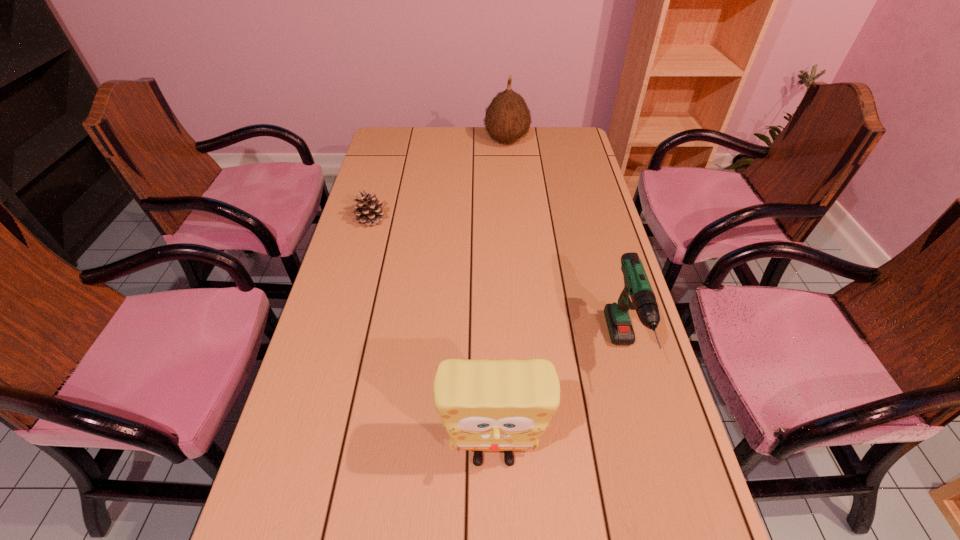
The image size is (960, 540). Find the location of `free space between the farthest object and the rightmost object`. free space between the farthest object and the rightmost object is located at coordinates (565, 246).

I want to click on vacant region between the coconut and the third nearest object, so pyautogui.click(x=439, y=180).

Where is `free point between the drill and the leftmost object`? free point between the drill and the leftmost object is located at coordinates (497, 286).

Where is `free space between the second farthest object and the nearest object`? This screenshot has width=960, height=540. free space between the second farthest object and the nearest object is located at coordinates (432, 338).

You are a GUI agent. You are given a task and a screenshot of the screen. Output one action in this format:
    pyautogui.click(x=<x>, y=<y>)
    Task: Click on the free spot between the nearest object and the coconut
    The image size is (960, 540).
    Given the screenshot: What is the action you would take?
    pyautogui.click(x=500, y=298)

Locate an element on the screen. The height and width of the screenshot is (540, 960). vacant point located between the pinecone and the third farthest object is located at coordinates (497, 286).

The height and width of the screenshot is (540, 960). Find the location of `object that can be found as the third closest to the third nearest object`. object that can be found as the third closest to the third nearest object is located at coordinates (637, 294).

Where is `object that can be found as the closest to the shortest object`? object that can be found as the closest to the shortest object is located at coordinates (507, 118).

At what (x,y) coordinates should I click in order to perform the action: click on vacant space that satisfies the following two spatial constraints: 1. on the surface of the coconut; 2. on the front side of the second farthest object. Please return your answer as a coordinate pair (x, y). This screenshot has height=540, width=960. Looking at the image, I should click on (514, 220).

Where is `vacant region that satisfies the following two spatial constraints: 1. on the surface of the farthest object; 2. on the face of the nearest object`? This screenshot has width=960, height=540. vacant region that satisfies the following two spatial constraints: 1. on the surface of the farthest object; 2. on the face of the nearest object is located at coordinates (533, 455).